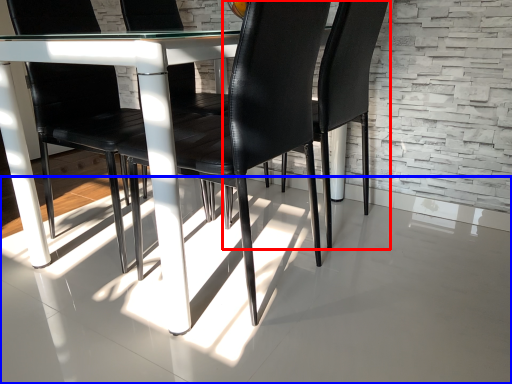
Question: Which point is closer to the camera, chair (highlighted by a red box) or concrete (highlighted by a blue box)?

Choices:
 (A) chair
 (B) concrete

Answer: (B)